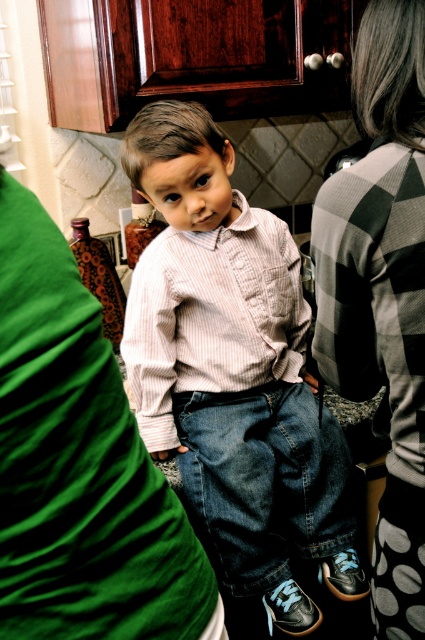
Consider the image. You are organizing a clothing display in a store and have two items to arrange. You have the striped cotton shirt at center and the checkered fabric sweater at right. If you want to place them vertically in order of their height from tallest to shortest, which should be placed first?

The striped cotton shirt at center should be placed first as it has a greater height compared to the checkered fabric sweater at right.